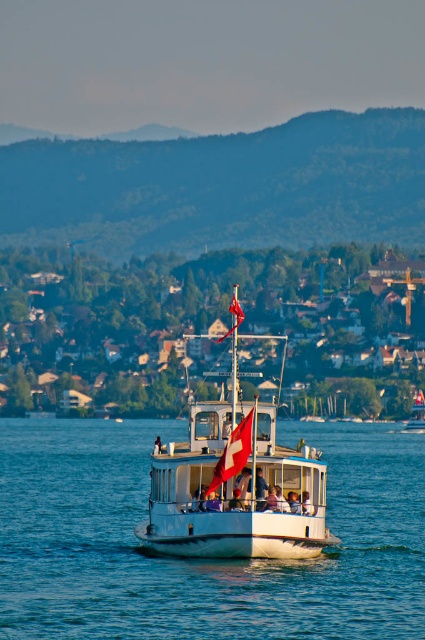
Does white wooden town at center appear under red fabric flag at center?

Yes.

Can you confirm if white wooden town at center is taller than red fabric flag at center?

Indeed, white wooden town at center has a greater height compared to red fabric flag at center.

I want to click on white wooden town at center, so click(210, 328).

This screenshot has width=425, height=640. Find the location of `white wooden town at center`. white wooden town at center is located at coordinates (210, 328).

Is point (166, 406) farther from viewer compared to point (241, 438)?

Yes, point (166, 406) is farther from viewer.

Is white wooden town at center smaller than swiss flag at center?

No.

Does point (322, 285) come behind point (232, 465)?

That is True.

Find the location of `white wooden town at center`. white wooden town at center is located at coordinates (210, 328).

Does clear blue water at center have a lesser height compared to white wooden town at center?

Yes.

Is the position of clear blue water at center more distant than that of white wooden town at center?

No, it is not.

Is point (67, 547) positioned behind point (50, 300)?

No, (67, 547) is in front of (50, 300).

Find the location of a particular element. The width and height of the screenshot is (425, 640). clear blue water at center is located at coordinates (201, 560).